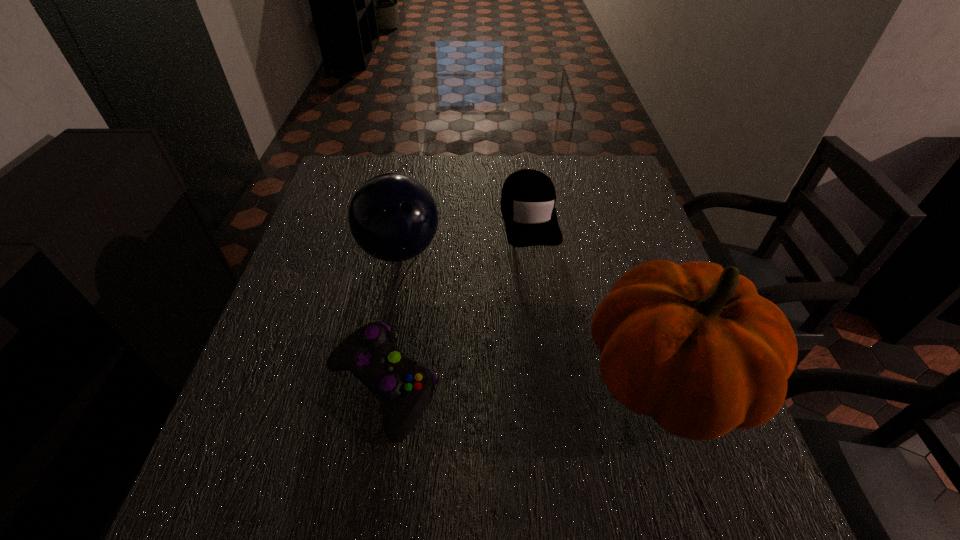
The image size is (960, 540). In order to click on vacant region at the far edge of the desktop in this screenshot , I will do `click(561, 191)`.

Locate an element on the screen. This screenshot has height=540, width=960. free location at the near edge of the desktop is located at coordinates (481, 434).

Where is `vacant space at the left edge of the desktop`? This screenshot has width=960, height=540. vacant space at the left edge of the desktop is located at coordinates (325, 323).

Where is `free space at the right edge of the desktop`? free space at the right edge of the desktop is located at coordinates (623, 249).

What are the coordinates of `vacant space at the near left corner of the desktop` in the screenshot? It's located at (300, 424).

Locate an element on the screen. The width and height of the screenshot is (960, 540). vacant space at the far right corner is located at coordinates (599, 179).

I want to click on free spot between the cap and the third shortest object, so click(x=465, y=234).

The image size is (960, 540). I want to click on vacant space that is in between the pumpkin and the bowling ball, so click(535, 315).

This screenshot has width=960, height=540. In order to click on blank region between the bowling ball and the pumpkin in this screenshot , I will do `click(535, 315)`.

Where is `free space between the bowling ball and the cap`? free space between the bowling ball and the cap is located at coordinates (465, 234).